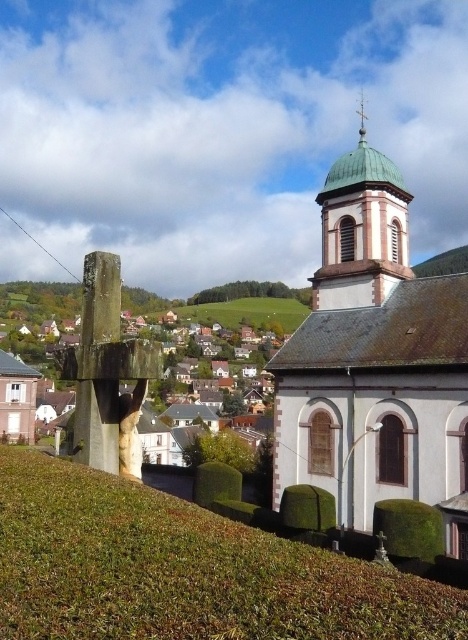
Question: Which of these objects is positioned closest to the green copper dome at upper right?

Choices:
 (A) green copper spire at upper center
 (B) green copper dome at upper center

Answer: (B)

Question: From the image, what is the correct spatial relationship of green leafy hedge at lower center in relation to green copper dome at upper center?

Choices:
 (A) left
 (B) right

Answer: (A)

Question: Can you confirm if green leafy hedge at lower center is bigger than green copper dome at upper right?

Choices:
 (A) no
 (B) yes

Answer: (A)

Question: Can you confirm if green copper dome at upper right is positioned below green copper spire at upper center?

Choices:
 (A) yes
 (B) no

Answer: (A)

Question: Which point appears farthest from the camera in this image?

Choices:
 (A) (363, 129)
 (B) (397, 253)

Answer: (A)

Question: Which point appears closest to the camera in this image?

Choices:
 (A) (373, 186)
 (B) (63, 289)
 (C) (363, 134)
 (D) (334, 198)

Answer: (A)